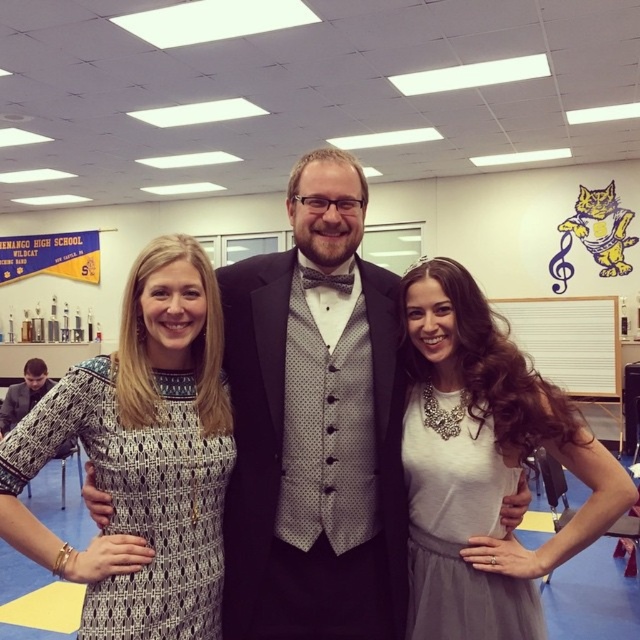
Can you confirm if printed fabric dress at center is shorter than white paper at upper right?

Indeed, printed fabric dress at center has a lesser height compared to white paper at upper right.

Where is `printed fabric dress at center`? The image size is (640, 640). printed fabric dress at center is located at coordinates (141, 456).

Find the location of a particular element. printed fabric dress at center is located at coordinates (141, 456).

Is black satin tuxedo at center thinner than white paper at upper right?

Yes.

Does black satin tuxedo at center appear on the right side of white paper at upper right?

Incorrect, black satin tuxedo at center is not on the right side of white paper at upper right.

Where is `black satin tuxedo at center`? Image resolution: width=640 pixels, height=640 pixels. black satin tuxedo at center is located at coordinates (314, 426).

Where is `gray tulle dress at center`? Image resolution: width=640 pixels, height=640 pixels. gray tulle dress at center is located at coordinates (458, 524).

Who is more forward, (499, 493) or (513, 300)?

Positioned in front is point (499, 493).

At what (x,y) coordinates should I click in order to perform the action: click on gray tulle dress at center. Please return your answer as a coordinate pair (x, y). The height and width of the screenshot is (640, 640). Looking at the image, I should click on (458, 524).